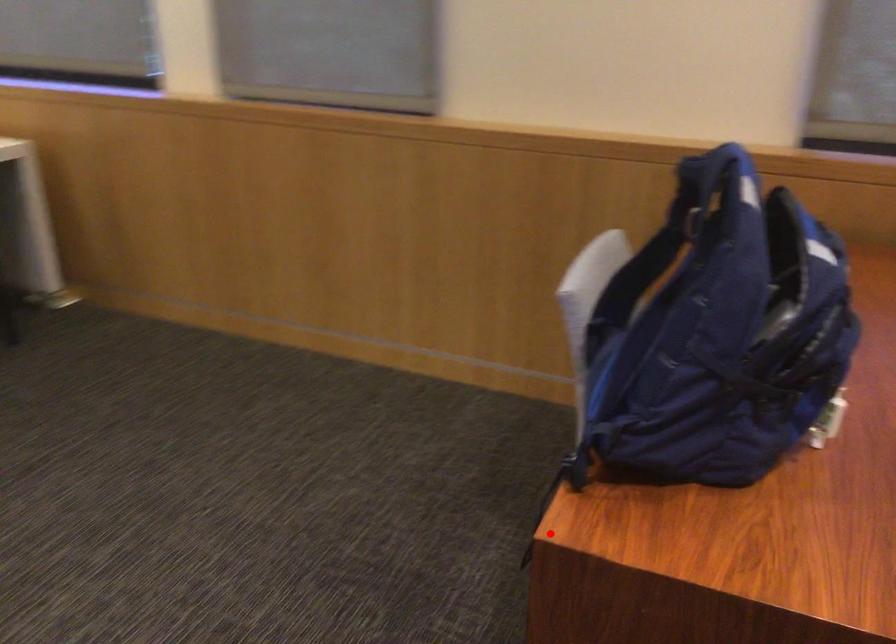
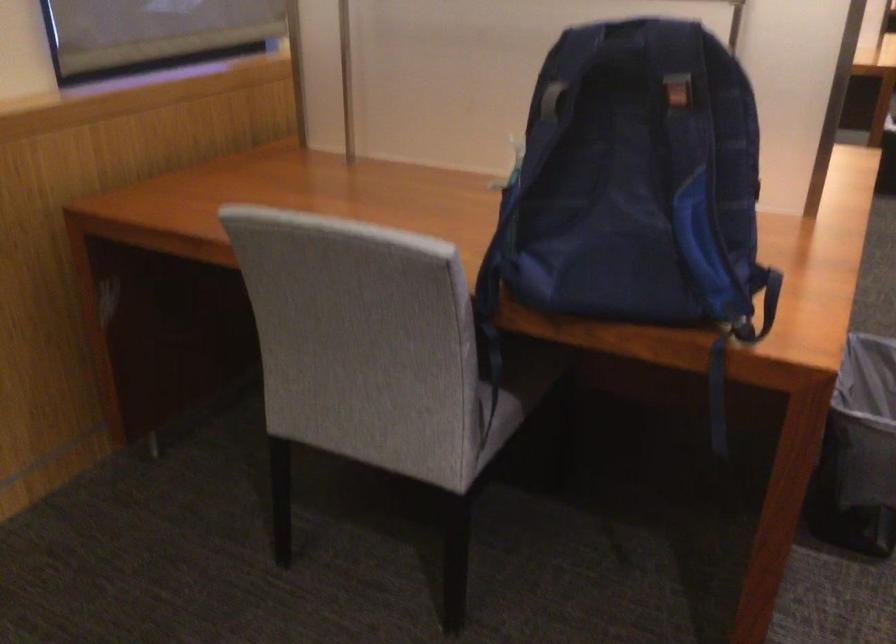
Find the pixel in the second image that matches the highlighted location in the first image.

(718, 395)